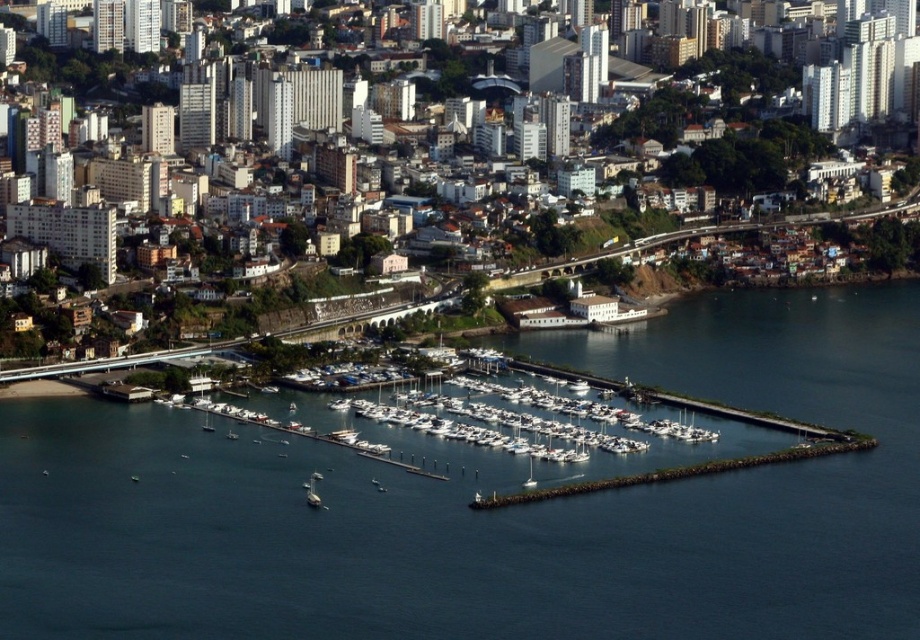
Is point (414, 403) closer to viewer compared to point (317, 493)?

No, (414, 403) is further to viewer.

Which is more to the left, white matte boats at center or white matte boat at lower center?

white matte boat at lower center

Is point (467, 385) less distant than point (312, 497)?

No.

The width and height of the screenshot is (920, 640). I want to click on white matte boats at center, so click(524, 420).

Can you confirm if dark blue water at center is positioned to the left of white matte boats at center?

Indeed, dark blue water at center is positioned on the left side of white matte boats at center.

What do you see at coordinates (487, 513) in the screenshot?
I see `dark blue water at center` at bounding box center [487, 513].

The width and height of the screenshot is (920, 640). Identify the location of dark blue water at center. (487, 513).

Who is shorter, dark blue water at center or white matte boat at lower center?

With less height is white matte boat at lower center.

The width and height of the screenshot is (920, 640). Describe the element at coordinates (487, 513) in the screenshot. I see `dark blue water at center` at that location.

The image size is (920, 640). I want to click on dark blue water at center, so click(x=487, y=513).